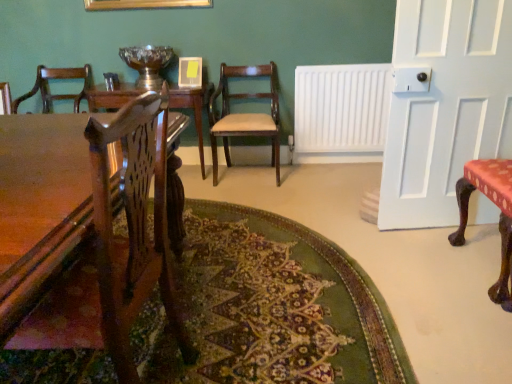
Question: From a real-world perspective, is green textured rug at center physically below mahogany wood chair at center, which appears as the 2th chair when viewed from the right?

Choices:
 (A) yes
 (B) no

Answer: (A)

Question: From a real-world perspective, does green textured rug at center stand above mahogany wood chair at center, positioned as the first chair in left-to-right order?

Choices:
 (A) yes
 (B) no

Answer: (B)

Question: From the image's perspective, is green textured rug at center located beneath mahogany wood chair at center, the second chair in the front-to-back sequence?

Choices:
 (A) yes
 (B) no

Answer: (A)

Question: Considering the relative positions of green textured rug at center and mahogany wood chair at center, which appears as the 2th chair when viewed from the right, in the image provided, is green textured rug at center to the right of mahogany wood chair at center, which appears as the 2th chair when viewed from the right, from the viewer's perspective?

Choices:
 (A) no
 (B) yes

Answer: (B)

Question: Is mahogany wood chair at center, the first chair when ordered from back to front, at the back of green textured rug at center?

Choices:
 (A) no
 (B) yes

Answer: (A)

Question: Does green textured rug at center have a lesser height compared to mahogany wood chair at center, which appears as the 2th chair when viewed from the right?

Choices:
 (A) no
 (B) yes

Answer: (B)

Question: Could you tell me if green textured rug at center is turned towards wooden table at center?

Choices:
 (A) yes
 (B) no

Answer: (B)

Question: Considering the relative sizes of green textured rug at center and wooden table at center in the image provided, is green textured rug at center taller than wooden table at center?

Choices:
 (A) no
 (B) yes

Answer: (A)

Question: From the image's perspective, does green textured rug at center appear higher than wooden table at center?

Choices:
 (A) yes
 (B) no

Answer: (B)

Question: Does green textured rug at center have a larger size compared to wooden table at center?

Choices:
 (A) yes
 (B) no

Answer: (B)

Question: Is green textured rug at center far away from wooden table at center?

Choices:
 (A) yes
 (B) no

Answer: (A)

Question: Is green textured rug at center smaller than wooden table at center?

Choices:
 (A) yes
 (B) no

Answer: (A)

Question: From a real-world perspective, is white painted wood door at right below red fabric-covered chair at right, which is the 2th chair in back-to-front order?

Choices:
 (A) no
 (B) yes

Answer: (A)